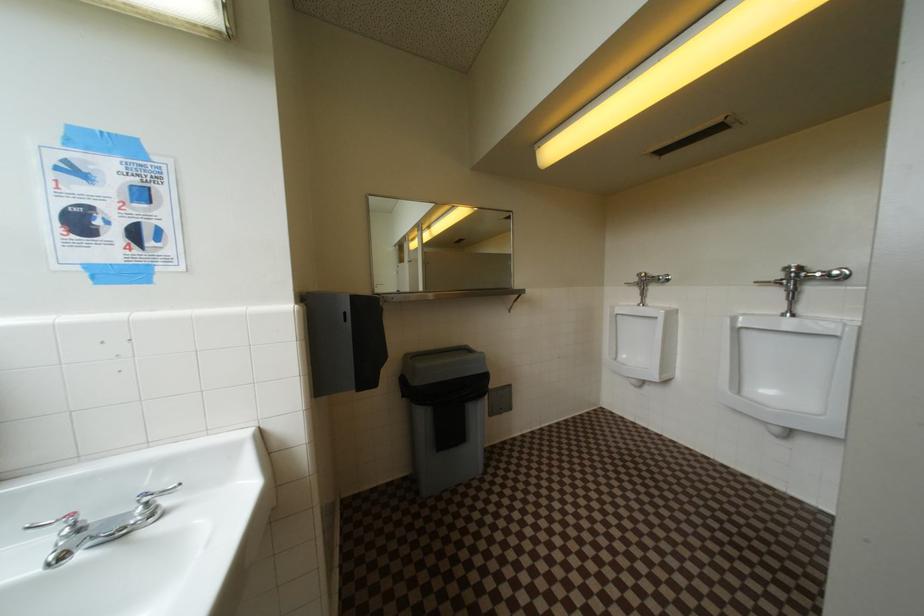
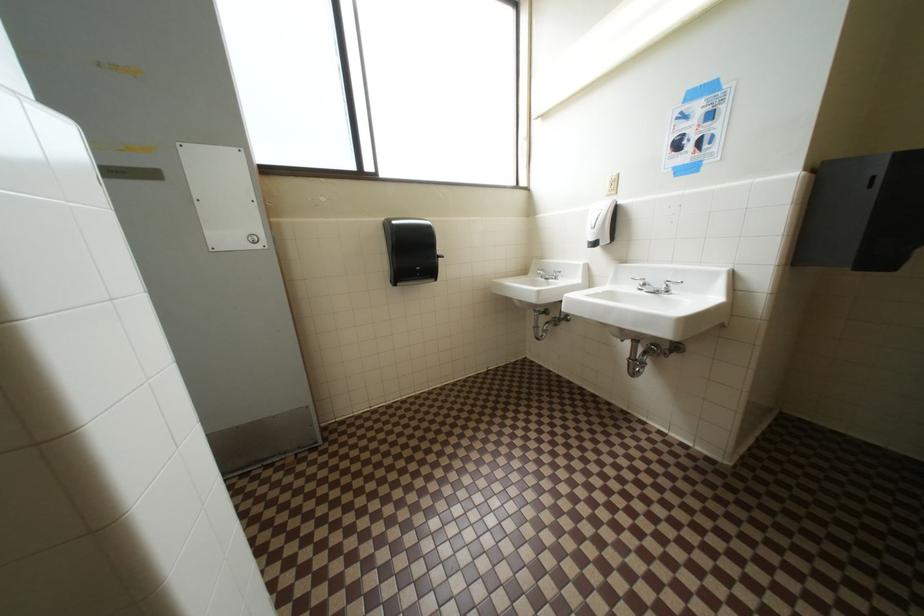
The images are taken continuously from a first-person perspective. In which direction is your viewpoint rotating?

The camera rotated toward left-down.